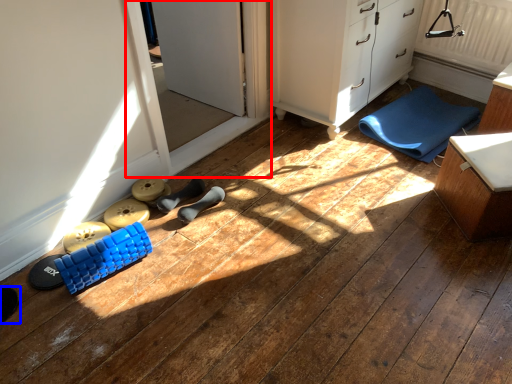
Question: Which point is further to the camera, screen door (highlighted by a red box) or footwear (highlighted by a blue box)?

Choices:
 (A) screen door
 (B) footwear

Answer: (A)